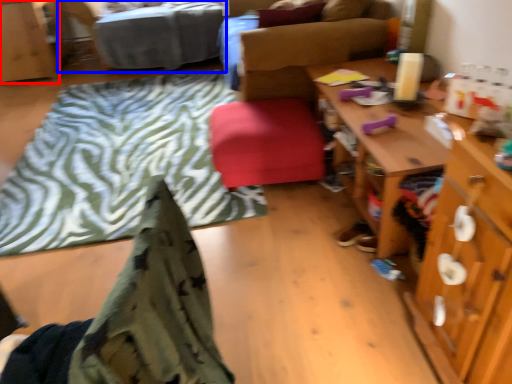
Question: Which point is further to the camera, cabinetry (highlighted by a red box) or bed (highlighted by a blue box)?

Choices:
 (A) cabinetry
 (B) bed

Answer: (A)